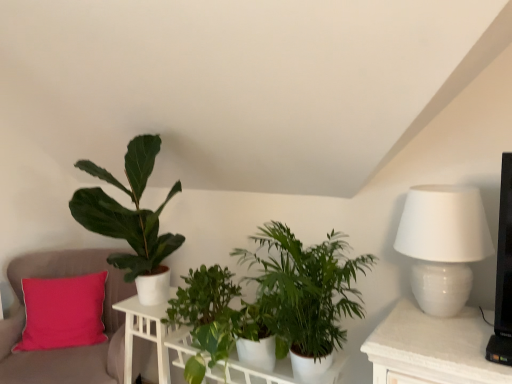
Question: Is white glossy shelf at center taller or shorter than white glossy table at center, acting as the 1th table starting from the right?

Choices:
 (A) tall
 (B) short

Answer: (B)

Question: Looking at the image, does white glossy shelf at center seem bigger or smaller compared to white glossy table at center, acting as the 1th table starting from the right?

Choices:
 (A) small
 (B) big

Answer: (A)

Question: Which object is the farthest from the green matte plant at center, the third houseplant when ordered from left to right?

Choices:
 (A) white glossy shelf at center
 (B) white wood table at lower left, which is the 2th table from right to left
 (C) green matte plant at center, marked as the 2th houseplant in a right-to-left arrangement
 (D) green matte plant at left, the third houseplant viewed from the right
 (E) white glossy table lamp at right

Answer: (B)

Question: Estimate the real-world distances between objects in this image. Which object is closer to the white glossy table lamp at right?

Choices:
 (A) white glossy shelf at center
 (B) green matte plant at left, the first houseplant from the left
 (C) pink fabric cushion at left
 (D) white glossy table at center, which is the 2th table from left to right
 (E) green matte plant at center, the third houseplant when ordered from left to right

Answer: (E)